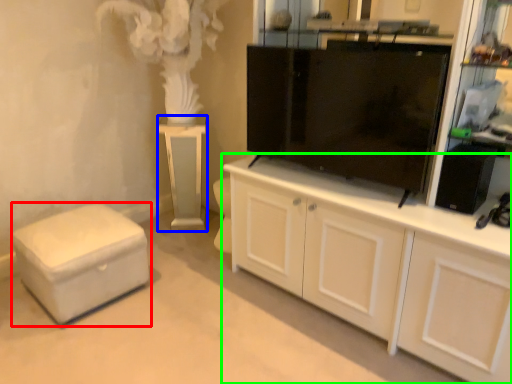
Question: Which is nearer to the furniture (highlighted by a red box)? table (highlighted by a blue box) or cabinetry (highlighted by a green box).

Choices:
 (A) table
 (B) cabinetry

Answer: (A)